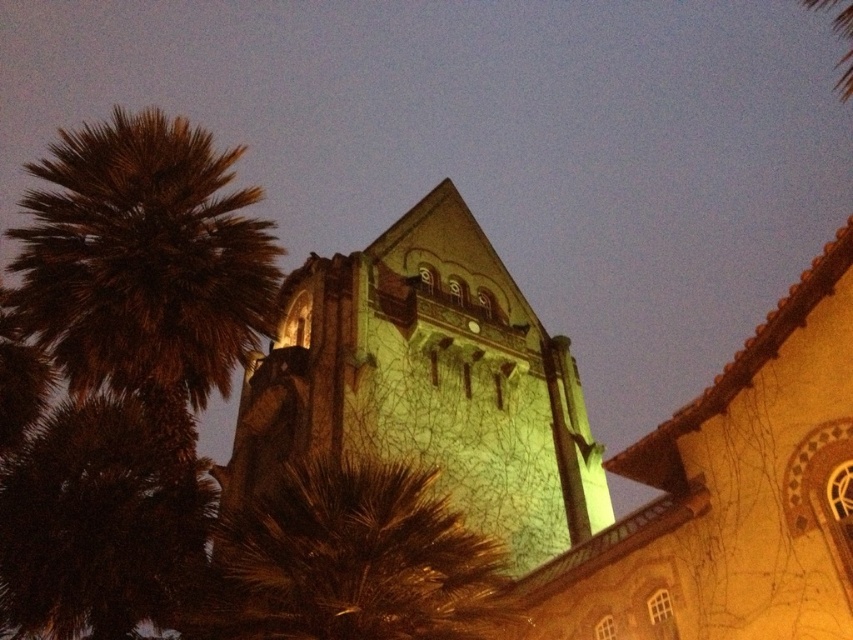
Question: Which of the following is the closest to the observer?

Choices:
 (A) (183, 131)
 (B) (480, 352)

Answer: (A)

Question: Among these objects, which one is farthest from the camera?

Choices:
 (A) brown fuzzy palm tree at left
 (B) green stone tower at center

Answer: (B)

Question: Can you confirm if green stone tower at center is smaller than brown fuzzy palm tree at left?

Choices:
 (A) no
 (B) yes

Answer: (B)

Question: From the image, what is the correct spatial relationship of green stone tower at center in relation to brown fuzzy palm tree at left?

Choices:
 (A) below
 (B) above

Answer: (A)

Question: Does green stone tower at center appear over brown fuzzy palm tree at left?

Choices:
 (A) yes
 (B) no

Answer: (B)